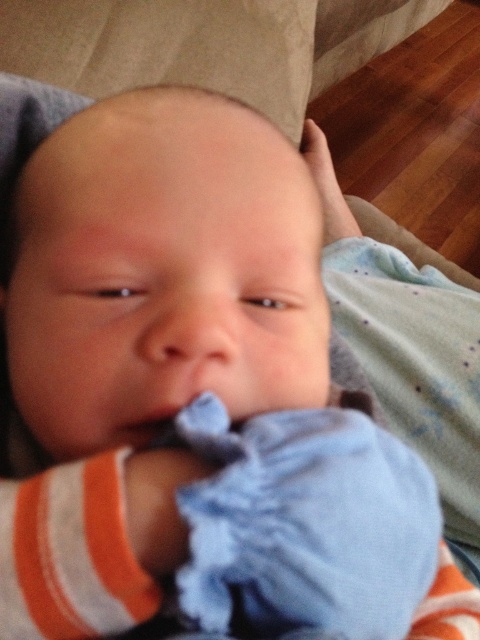
Does smooth skin nose at center have a greater height compared to smooth blue cloth at center?

Yes, smooth skin nose at center is taller than smooth blue cloth at center.

Is smooth skin nose at center shorter than smooth blue cloth at center?

Incorrect, smooth skin nose at center's height does not fall short of smooth blue cloth at center's.

Is point (223, 330) in front of point (136, 445)?

Yes, it is in front of point (136, 445).

Locate an element on the screen. The image size is (480, 640). smooth skin nose at center is located at coordinates (189, 330).